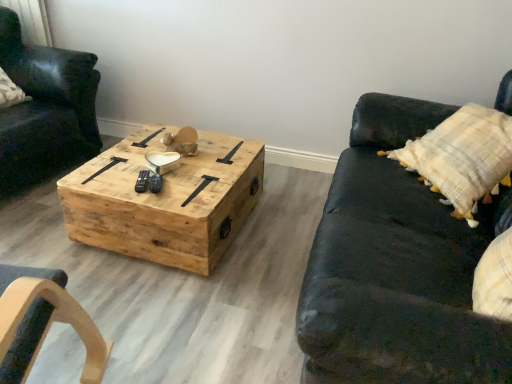
Question: From a real-world perspective, relative to black leather couch at right, is matte black leather chair at left vertically above or below?

Choices:
 (A) below
 (B) above

Answer: (B)

Question: Relative to black leather couch at right, is matte black leather chair at left in front or behind?

Choices:
 (A) behind
 (B) front

Answer: (A)

Question: Considering the real-world distances, which object is closest to the natural wood coffee table at center?

Choices:
 (A) black leather couch at right
 (B) matte black leather chair at left

Answer: (A)

Question: Estimate the real-world distances between objects in this image. Which object is farther from the black leather couch at right?

Choices:
 (A) matte black leather chair at left
 (B) natural wood coffee table at center

Answer: (A)